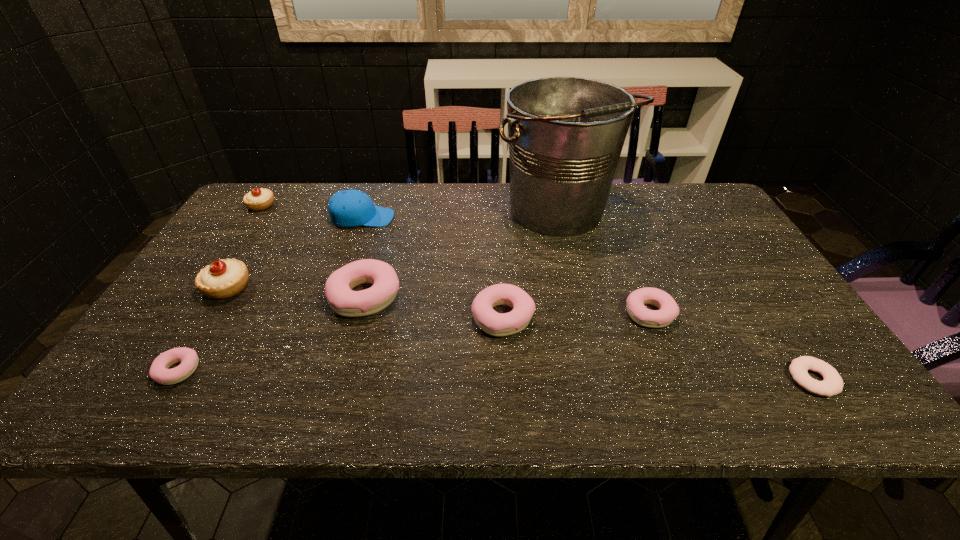
You are a GUI agent. You are given a task and a screenshot of the screen. Output one action in this format:
    pyautogui.click(x=<x>, y=<y>)
    Task: Click on the vacant area that lies between the third shortest object and the doughnut
    The width and height of the screenshot is (960, 540).
    Given the screenshot: What is the action you would take?
    pyautogui.click(x=732, y=347)

Image resolution: width=960 pixels, height=540 pixels. Identify the location of vacant point located between the blue cap and the bucket. (461, 215).

Where is `vacant area between the tallest object and the rightmost object`? Image resolution: width=960 pixels, height=540 pixels. vacant area between the tallest object and the rightmost object is located at coordinates click(x=685, y=296).

The height and width of the screenshot is (540, 960). I want to click on free space between the biggest pink pastry and the bucket, so click(463, 254).

You are a GUI agent. You are given a task and a screenshot of the screen. Output one action in this format:
    pyautogui.click(x=<x>, y=<y>)
    Task: Click on the free space between the blue cap and the farthest pastry
    The image size is (960, 540).
    Given the screenshot: What is the action you would take?
    pyautogui.click(x=312, y=212)

This screenshot has width=960, height=540. In order to click on vacant area that lies between the second pink pastry from left to right and the rightmost object in this screenshot , I will do 589,338.

You are a GUI agent. You are given a task and a screenshot of the screen. Output one action in this format:
    pyautogui.click(x=<x>, y=<y>)
    Task: Click on the free spot between the blue cap and the doughnut
    
    Given the screenshot: What is the action you would take?
    [588, 299]

The image size is (960, 540). Identify the location of the fourth closest object to the tallest pastry. (258, 199).

Identify the location of object that stands as the fifth closest to the smallest pink pastry. (496, 324).

Locate an element on the screen. The width and height of the screenshot is (960, 540). pastry that is the third nearest to the shortest pastry is located at coordinates (258, 199).